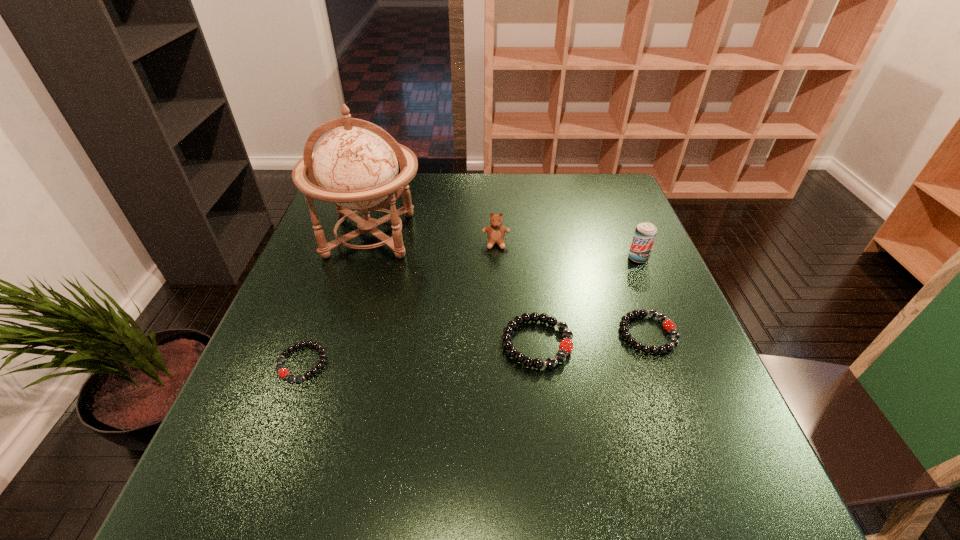
Locate an element on the screen. The height and width of the screenshot is (540, 960). location for an additional bracelet to make spacing equal is located at coordinates (422, 353).